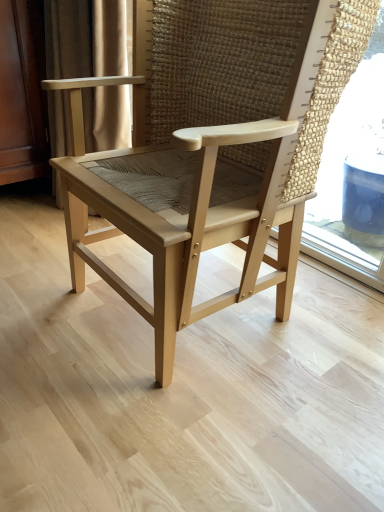
You are a GUI agent. You are given a task and a screenshot of the screen. Output one action in this format:
    pyautogui.click(x=<x>, y=<y>)
    Task: Click on the vacant point to the right of natural wood chair at center
    This screenshot has width=384, height=512.
    Given the screenshot: What is the action you would take?
    pyautogui.click(x=332, y=327)